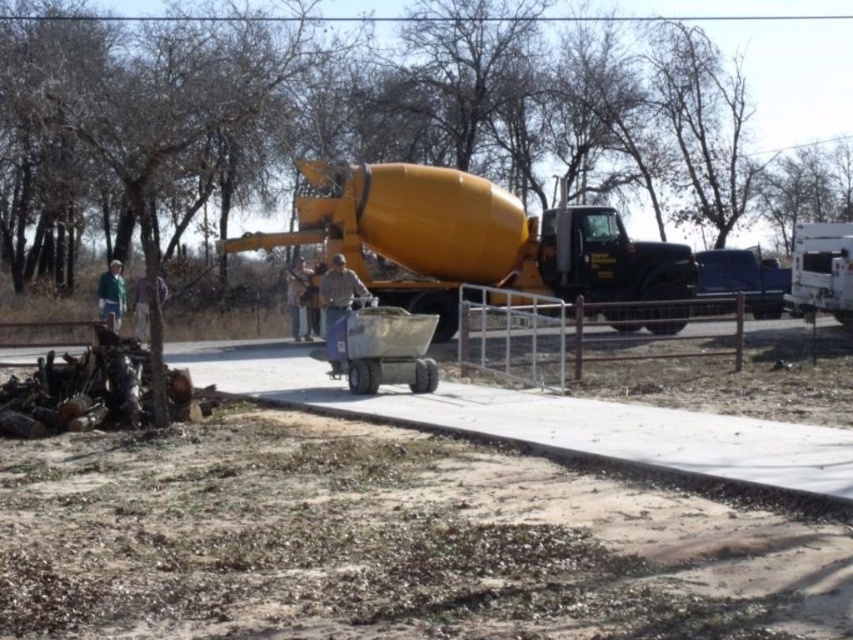
You are a construction worker observing the scene. You need to determine which clothing item is taller between the tan fabric shirt at center and the dark gray fabric jacket at center. Which one is taller?

The tan fabric shirt at center is taller than the dark gray fabric jacket at center according to the description provided.

You are a construction worker who needs to transport materials from the yellow matte concrete mixer at center to the smooth concrete sidewalk at center. Given that your wheelbarrow can carry a maximum load of 100 pounds and you can push it 100 feet before needing to rest, can you safely transport a 90 pound load of concrete mix without needing to rest?

The smooth concrete sidewalk at center and yellow matte concrete mixer at center are 61.28 feet apart from each other. Since the distance is less than 100 feet, you can safely transport the 90 pound load without needing to rest.

You are a construction worker who just arrived at the site. You see a camouflage jacket at center and a green fabric jacket at left. Which jacket is closer to the ground?

→ The camouflage jacket at center is closer to the ground because it is below the green fabric jacket at left.